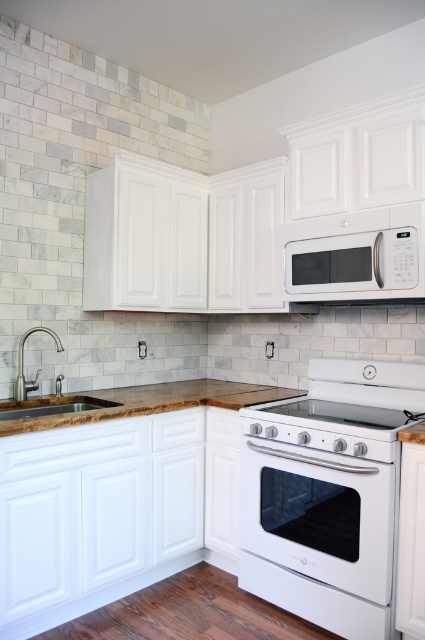
You are a chef preparing to place a large pot on the counter. The pot requires a space of at least 26 inches to be placed safely. Can the white glossy electric stove at center and the wooden countertop at lower left provide enough space for the pot?

The distance between the white glossy electric stove at center and the wooden countertop at lower left is 25.61 inches, which is slightly less than the required 26 inches. Therefore, the space is insufficient for safely placing the large pot.

You are a chef preparing to place a large pot on the white glossy electric stove at center and the wooden countertop at lower left. Which surface can accommodate the pot more comfortably?

The white glossy electric stove at center is larger in size than the wooden countertop at lower left, so it can accommodate the pot more comfortably.

You are planning to install a new microwave in your kitchen. You have a white matte microwave at upper center and a brushed nickel faucet at left. Which one is smaller in size?

The white matte microwave at upper center has a smaller size compared to the brushed nickel faucet at left.